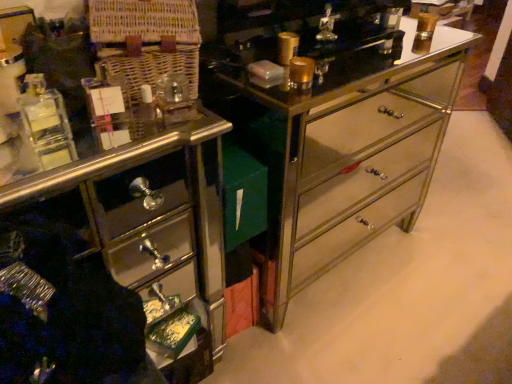
Question: From the image's perspective, does shiny mirrored drawer at lower left appear higher than metallic mirrored dresser at center?

Choices:
 (A) no
 (B) yes

Answer: (A)

Question: Considering the relative sizes of shiny mirrored drawer at lower left and metallic mirrored dresser at center in the image provided, is shiny mirrored drawer at lower left bigger than metallic mirrored dresser at center?

Choices:
 (A) yes
 (B) no

Answer: (B)

Question: Would you consider shiny mirrored drawer at lower left to be distant from metallic mirrored dresser at center?

Choices:
 (A) yes
 (B) no

Answer: (B)

Question: Is shiny mirrored drawer at lower left with metallic mirrored dresser at center?

Choices:
 (A) no
 (B) yes

Answer: (A)

Question: Is shiny mirrored drawer at lower left aimed at metallic mirrored dresser at center?

Choices:
 (A) yes
 (B) no

Answer: (B)

Question: Can you confirm if shiny mirrored drawer at lower left is wider than metallic mirrored dresser at center?

Choices:
 (A) yes
 (B) no

Answer: (B)

Question: Is metallic mirrored dresser at center closer to the viewer compared to shiny mirrored drawer at lower left?

Choices:
 (A) yes
 (B) no

Answer: (B)

Question: Does metallic mirrored dresser at center have a lesser width compared to shiny mirrored drawer at lower left?

Choices:
 (A) yes
 (B) no

Answer: (B)

Question: Does metallic mirrored dresser at center have a smaller size compared to shiny mirrored drawer at lower left?

Choices:
 (A) yes
 (B) no

Answer: (B)

Question: Can you confirm if metallic mirrored dresser at center is bigger than shiny mirrored drawer at lower left?

Choices:
 (A) no
 (B) yes

Answer: (B)

Question: Is metallic mirrored dresser at center positioned behind shiny mirrored drawer at lower left?

Choices:
 (A) yes
 (B) no

Answer: (A)

Question: Does metallic mirrored dresser at center turn towards shiny mirrored drawer at lower left?

Choices:
 (A) yes
 (B) no

Answer: (B)

Question: Considering the positions of point (233, 104) and point (79, 254), is point (233, 104) closer or farther from the camera than point (79, 254)?

Choices:
 (A) farther
 (B) closer

Answer: (A)